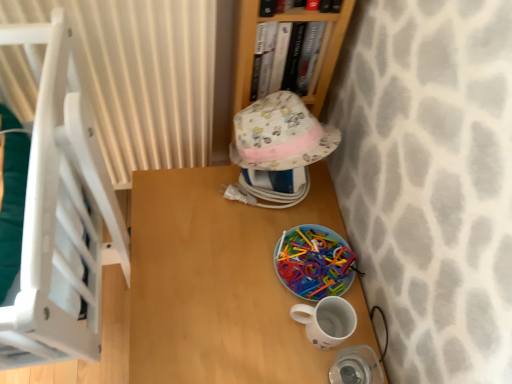
I want to click on free space behind white glossy mug at lower right, so (311, 219).